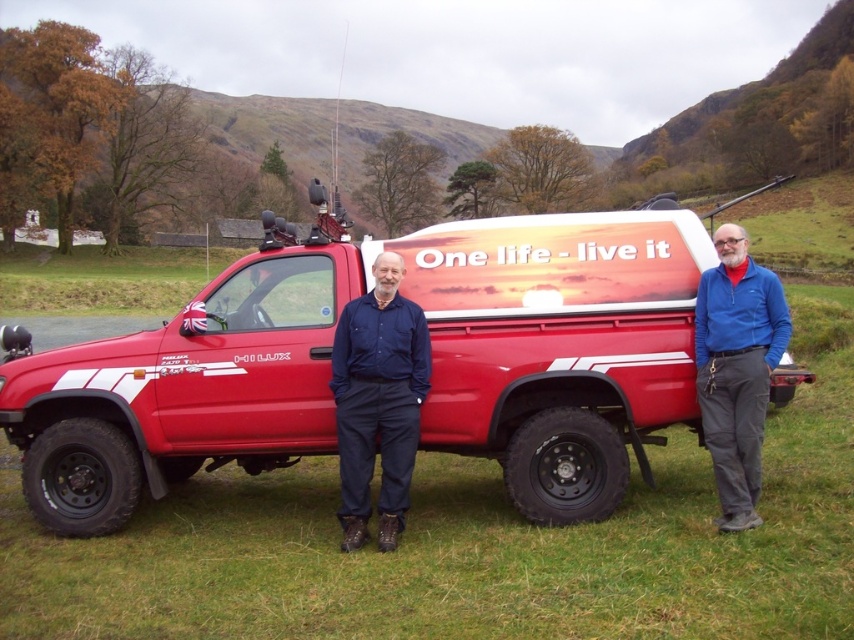
Based on the scene description, where is the shiny red truck at center located in the image?

The shiny red truck at center is located at point coordinates of [431,364].

You are a photographer trying to capture both the shiny red truck at center and the blue fabric jacket at right in a single frame. Based on their sizes in the image, which object would you need to focus on first to ensure both are in focus?

The shiny red truck at center is bigger than the blue fabric jacket at right, so you should focus on the shiny red truck at center first to ensure both are in focus.

Consider the image. You are a photographer setting up a shoot near the red Toyota Hilux pickup truck. You notice the matte blue shirt at center and the blue fabric jacket at right. Which clothing item is positioned higher in the image?

The matte blue shirt at center is positioned higher than the blue fabric jacket at right in the image.